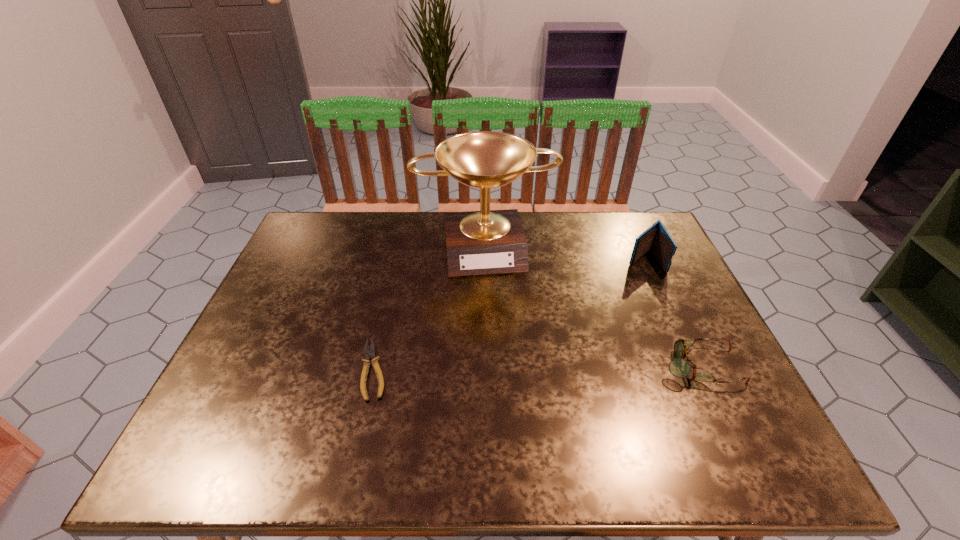
You are a GUI agent. You are given a task and a screenshot of the screen. Output one action in this format:
    pyautogui.click(x=<x>, y=<y>)
    Task: Click on the object that is at the near right corner
    This screenshot has height=540, width=960.
    Given the screenshot: What is the action you would take?
    pyautogui.click(x=679, y=367)

In the image, there is a desktop. Find the location of `vacant space at the far edge`. vacant space at the far edge is located at coordinates pos(592,220).

The height and width of the screenshot is (540, 960). In the image, there is a desktop. Find the location of `vacant space at the near edge`. vacant space at the near edge is located at coordinates pos(424,409).

Find the location of a particular element. The image size is (960, 540). vacant space at the left edge of the desktop is located at coordinates (317, 260).

Locate an element on the screen. The image size is (960, 540). vacant space at the right edge of the desktop is located at coordinates (646, 272).

In the image, there is a desktop. At what (x,y) coordinates should I click in order to perform the action: click on free space at the far left corner. Please return your answer as a coordinate pair (x, y). This screenshot has width=960, height=540. Looking at the image, I should click on (309, 219).

In the image, there is a desktop. Where is `vacant space at the near left corner`? The height and width of the screenshot is (540, 960). vacant space at the near left corner is located at coordinates (231, 393).

Image resolution: width=960 pixels, height=540 pixels. I want to click on empty space that is in between the spectacles and the shortest object, so click(537, 368).

Where is `vacant area between the wallet and the spectacles`? Image resolution: width=960 pixels, height=540 pixels. vacant area between the wallet and the spectacles is located at coordinates (672, 313).

The height and width of the screenshot is (540, 960). I want to click on unoccupied position between the wallet and the third tallest object, so [x=672, y=313].